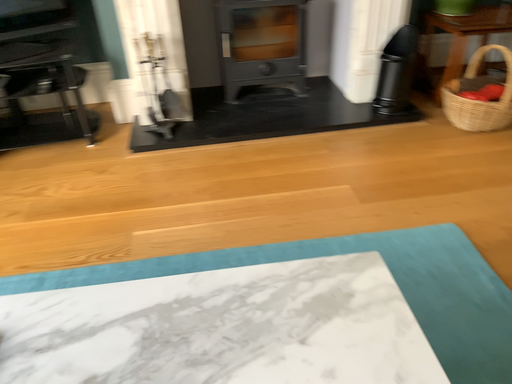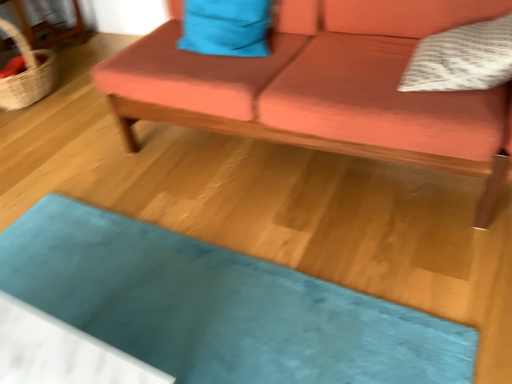
Question: Which way did the camera rotate in the video?

Choices:
 (A) rotated right
 (B) rotated left

Answer: (A)